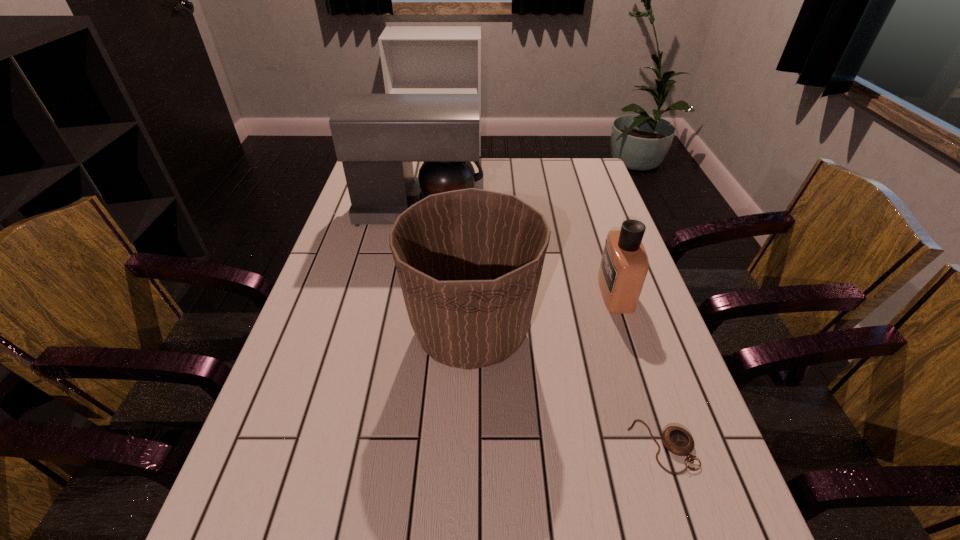
This screenshot has width=960, height=540. What are the coordinates of `coffee maker` in the screenshot? It's located at (377, 137).

In order to click on flowerpot in this screenshot , I will do `click(469, 261)`.

Locate an element on the screen. The height and width of the screenshot is (540, 960). the third tallest object is located at coordinates (624, 265).

Locate an element on the screen. The height and width of the screenshot is (540, 960). pocket watch is located at coordinates (677, 440).

You are a GUI agent. You are given a task and a screenshot of the screen. Output one action in this format:
    pyautogui.click(x=<x>, y=<y>)
    Task: Click on the nearest object
    The image size is (960, 540).
    Given the screenshot: What is the action you would take?
    pyautogui.click(x=677, y=440)

Locate an element on the screen. free space located 0.140m on the carafe side of the farthest object is located at coordinates (526, 208).

Where is `free space located on the front of the flowerpot`? The height and width of the screenshot is (540, 960). free space located on the front of the flowerpot is located at coordinates (469, 446).

Identify the location of vacant area located on the front label of the third tallest object. (520, 293).

Image resolution: width=960 pixels, height=540 pixels. I want to click on vacant space located 0.100m on the front label of the third tallest object, so click(563, 293).

The height and width of the screenshot is (540, 960). I want to click on free space located 0.210m on the front label of the third tallest object, so click(520, 293).